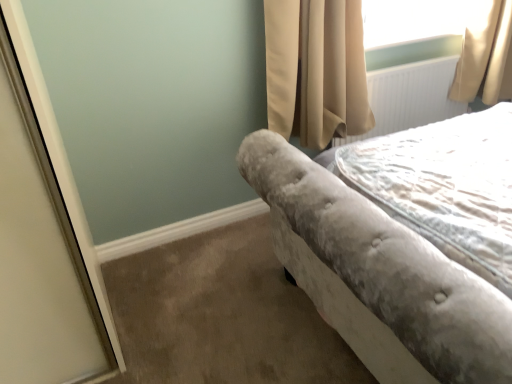
Question: Could you tell me if beige velvet curtain at upper right is facing velvet gray bedspread at right?

Choices:
 (A) yes
 (B) no

Answer: (A)

Question: From the image's perspective, is beige velvet curtain at upper right located beneath velvet gray bedspread at right?

Choices:
 (A) yes
 (B) no

Answer: (B)

Question: Is beige velvet curtain at upper right positioned beyond the bounds of velvet gray bedspread at right?

Choices:
 (A) no
 (B) yes

Answer: (B)

Question: Is beige velvet curtain at upper right far from velvet gray bedspread at right?

Choices:
 (A) no
 (B) yes

Answer: (A)

Question: Is beige velvet curtain at upper right in contact with velvet gray bedspread at right?

Choices:
 (A) no
 (B) yes

Answer: (A)

Question: Would you say beige velvet curtain at upper right is to the left or to the right of velvet gray bedspread at right in the picture?

Choices:
 (A) left
 (B) right

Answer: (A)

Question: Looking at their shapes, would you say beige velvet curtain at upper right is wider or thinner than velvet gray bedspread at right?

Choices:
 (A) wide
 (B) thin

Answer: (B)

Question: From the image's perspective, relative to velvet gray bedspread at right, is beige velvet curtain at upper right above or below?

Choices:
 (A) above
 (B) below

Answer: (A)

Question: Considering the positions of beige velvet curtain at upper right and velvet gray bedspread at right in the image, is beige velvet curtain at upper right bigger or smaller than velvet gray bedspread at right?

Choices:
 (A) big
 (B) small

Answer: (B)

Question: Based on their positions, is velvet gray bedspread at right located to the left or right of velvet gray bed at right?

Choices:
 (A) left
 (B) right

Answer: (A)

Question: Looking at their shapes, would you say velvet gray bedspread at right is wider or thinner than velvet gray bed at right?

Choices:
 (A) thin
 (B) wide

Answer: (A)

Question: From the image's perspective, is velvet gray bedspread at right positioned above or below velvet gray bed at right?

Choices:
 (A) below
 (B) above

Answer: (A)

Question: Looking at the image, does velvet gray bedspread at right seem bigger or smaller compared to velvet gray bed at right?

Choices:
 (A) small
 (B) big

Answer: (A)

Question: Based on their sizes in the image, would you say velvet gray bedspread at right is bigger or smaller than white textured radiator at upper right?

Choices:
 (A) small
 (B) big

Answer: (B)

Question: From the image's perspective, relative to white textured radiator at upper right, is velvet gray bedspread at right above or below?

Choices:
 (A) below
 (B) above

Answer: (A)